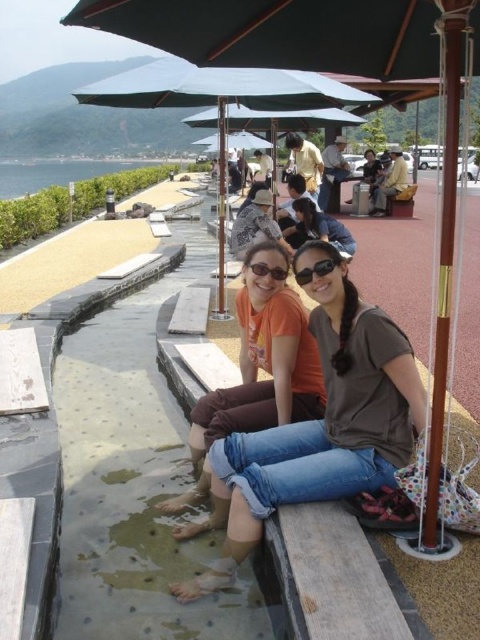
Question: Can you confirm if orange t-shirt at center is positioned to the left of green fabric umbrella at center?

Choices:
 (A) no
 (B) yes

Answer: (B)

Question: Which point appears closest to the camera in this image?

Choices:
 (A) (243, 300)
 (B) (314, 268)
 (C) (297, 104)

Answer: (B)

Question: Can you confirm if denim jeans at center is thinner than matte black sunglasses at center?

Choices:
 (A) yes
 (B) no

Answer: (B)

Question: Considering the real-world distances, which object is farthest from the matte black sunglasses at center?

Choices:
 (A) orange t-shirt at center
 (B) denim jeans at center

Answer: (B)

Question: Estimate the real-world distances between objects in this image. Which object is closer to the green fabric umbrella at center?

Choices:
 (A) denim jeans at center
 (B) orange t-shirt at center
 (C) black matte sunglasses at center
 (D) matte black sunglasses at center

Answer: (B)

Question: Can you confirm if denim jeans at center is positioned to the left of black matte sunglasses at center?

Choices:
 (A) no
 (B) yes

Answer: (B)